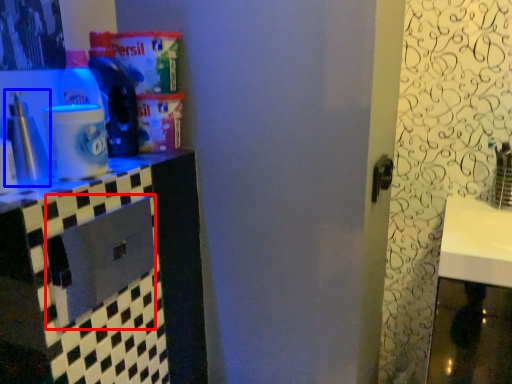
Question: Which point is closer to the camera, drawer (highlighted by a red box) or bottle (highlighted by a blue box)?

Choices:
 (A) drawer
 (B) bottle

Answer: (A)